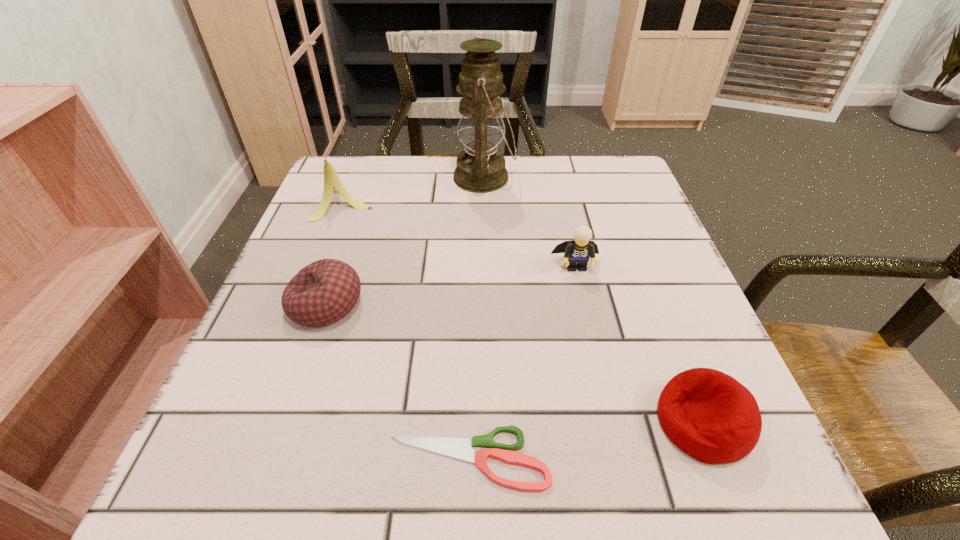
Identify the location of free space located 0.230m on the right of the fifth shortest object. The width and height of the screenshot is (960, 540). (475, 201).

Locate an element on the screen. free point located 0.200m on the front-facing side of the Lego is located at coordinates (599, 366).

Find the location of `free space located 0.350m on the right of the farther beanbag`. free space located 0.350m on the right of the farther beanbag is located at coordinates (563, 305).

Find the location of a particular element. The height and width of the screenshot is (540, 960). vacant space located 0.060m on the seat area of the rightmost object is located at coordinates coord(614,422).

The width and height of the screenshot is (960, 540). What are the coordinates of `vacant space located on the seat area of the rightmost object` in the screenshot? It's located at (492, 422).

Find the location of a particular element. The width and height of the screenshot is (960, 540). vacant space situated on the seat area of the rightmost object is located at coordinates (428, 422).

This screenshot has height=540, width=960. In order to click on vacant space located on the back of the scissors in this screenshot , I will do `click(470, 384)`.

Find the location of a particular element. Image resolution: width=960 pixels, height=540 pixels. oil lamp that is positioned at the far edge is located at coordinates (480, 169).

In order to click on banana that is at the far edge in this screenshot , I will do `click(332, 182)`.

Identify the location of beanbag that is at the near edge. (709, 415).